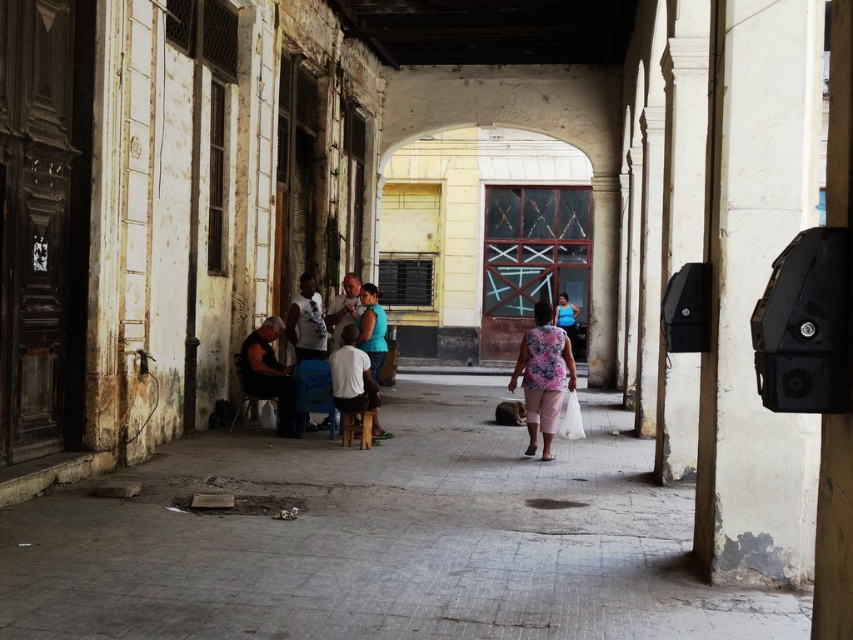
Question: Where is concrete floor at center located in relation to wooden stool at center in the image?

Choices:
 (A) left
 (B) right

Answer: (B)

Question: Is concrete floor at center positioned behind wooden stool at center?

Choices:
 (A) no
 (B) yes

Answer: (A)

Question: Is concrete floor at center above dark blue shirt at center?

Choices:
 (A) no
 (B) yes

Answer: (A)

Question: Estimate the real-world distances between objects in this image. Which object is closer to the wooden stool at center?

Choices:
 (A) concrete floor at center
 (B) dark gray fabric shirt at center-left

Answer: (B)

Question: Which object is farther from the camera taking this photo?

Choices:
 (A) floral fabric dress at center
 (B) wooden stool at center
 (C) concrete floor at center
 (D) dark gray fabric shirt at center-left

Answer: (D)

Question: Which point is farther to the camera?

Choices:
 (A) (527, 374)
 (B) (367, 387)

Answer: (B)